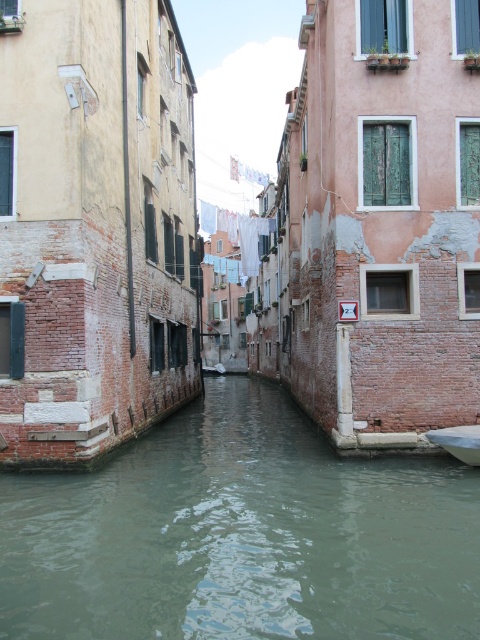
Does point (352, 467) lie behind point (440, 433)?

Yes, point (352, 467) is farther from viewer.

Does point (379, 460) come in front of point (444, 436)?

No, it is behind (444, 436).

Is point (84, 636) behind point (464, 448)?

No, (84, 636) is closer to viewer.

Identify the location of greenish water at center. This screenshot has width=480, height=640. (241, 536).